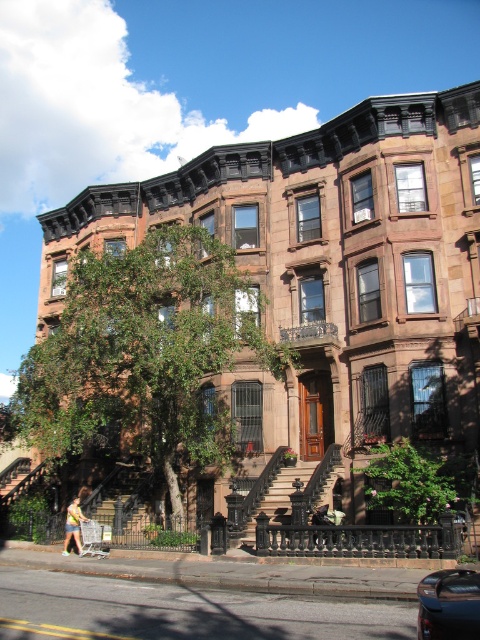
This screenshot has height=640, width=480. I want to click on green leafy tree at left, so click(144, 355).

Does green leafy tree at left have a smaller size compared to shiny black car at lower right?

No.

Which is behind, point (219, 275) or point (469, 612)?

The point (219, 275) is behind.

Identify the location of green leafy tree at left. (144, 355).